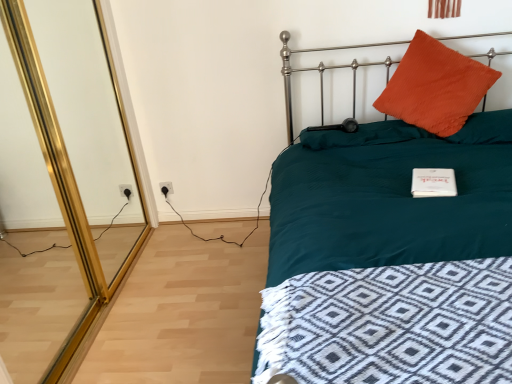
Find the location of a particular element. vacant space to the left of gold mirrored screen door at left is located at coordinates (48, 303).